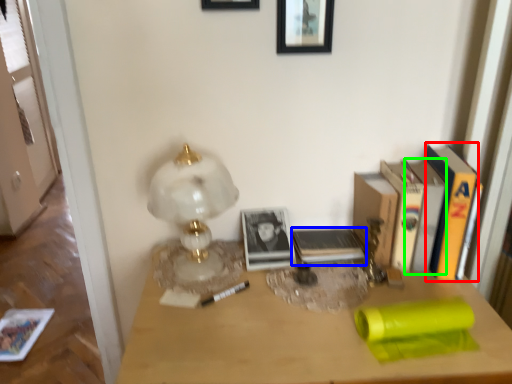
Question: Based on their relative distances, which object is nearer to paperback book (highlighted by a red box)? Choose from paperback book (highlighted by a blue box) and paperback book (highlighted by a green box).

Choices:
 (A) paperback book
 (B) paperback book

Answer: (B)